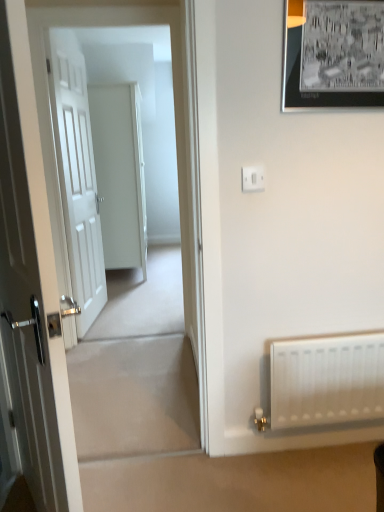
Question: Can you confirm if black matte picture frame at upper right is shorter than white glossy door at center, marked as the first door in a back-to-front arrangement?

Choices:
 (A) yes
 (B) no

Answer: (A)

Question: From a real-world perspective, is black matte picture frame at upper right physically above white glossy door at center, which appears as the 3th door when viewed from the front?

Choices:
 (A) no
 (B) yes

Answer: (B)

Question: Considering the relative positions of black matte picture frame at upper right and white glossy door at center, which appears as the 3th door when viewed from the front, in the image provided, is black matte picture frame at upper right to the right of white glossy door at center, which appears as the 3th door when viewed from the front, from the viewer's perspective?

Choices:
 (A) yes
 (B) no

Answer: (A)

Question: From the image's perspective, is black matte picture frame at upper right on top of white glossy door at center, marked as the first door in a back-to-front arrangement?

Choices:
 (A) yes
 (B) no

Answer: (B)

Question: Does black matte picture frame at upper right have a smaller size compared to white glossy door at center, which appears as the 3th door when viewed from the front?

Choices:
 (A) yes
 (B) no

Answer: (A)

Question: Does black matte picture frame at upper right appear on the left side of white glossy door at center, marked as the first door in a back-to-front arrangement?

Choices:
 (A) yes
 (B) no

Answer: (B)

Question: Considering the relative sizes of white wooden door at left, arranged as the second door when viewed from the back, and black matte picture frame at upper right in the image provided, is white wooden door at left, arranged as the second door when viewed from the back, wider than black matte picture frame at upper right?

Choices:
 (A) no
 (B) yes

Answer: (B)

Question: Can you confirm if white wooden door at left, the 2th door when ordered from front to back, is positioned to the right of black matte picture frame at upper right?

Choices:
 (A) no
 (B) yes

Answer: (A)

Question: From the image's perspective, does white wooden door at left, the 2th door when ordered from front to back, appear lower than black matte picture frame at upper right?

Choices:
 (A) no
 (B) yes

Answer: (B)

Question: Is white wooden door at left, arranged as the second door when viewed from the back, oriented towards black matte picture frame at upper right?

Choices:
 (A) no
 (B) yes

Answer: (A)

Question: Does white wooden door at left, arranged as the second door when viewed from the back, come behind black matte picture frame at upper right?

Choices:
 (A) no
 (B) yes

Answer: (B)

Question: Is white wooden door at left, arranged as the second door when viewed from the back, outside black matte picture frame at upper right?

Choices:
 (A) yes
 (B) no

Answer: (A)

Question: Is white matte radiator at lower right taller than white matte door at left, which appears as the first door when viewed from the front?

Choices:
 (A) no
 (B) yes

Answer: (A)